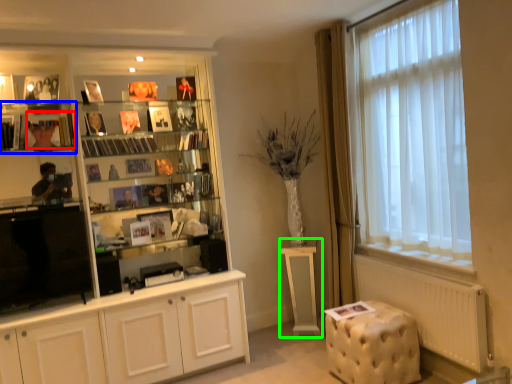
Question: Which object is the closest to the book (highlighted by a red box)? Choose among these: shelf (highlighted by a blue box) or table (highlighted by a green box).

Choices:
 (A) shelf
 (B) table

Answer: (A)